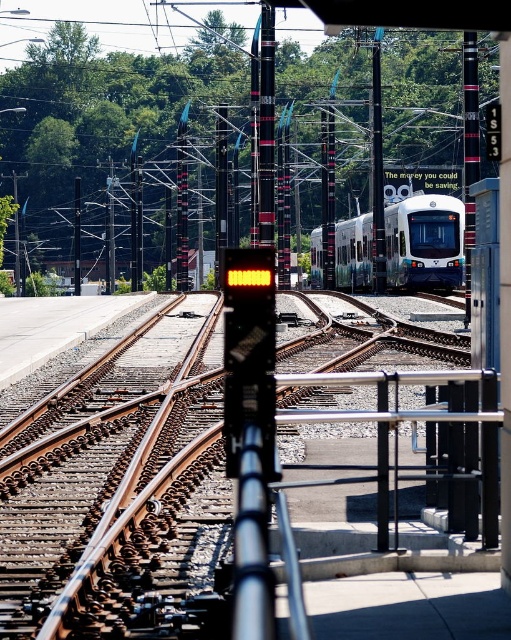
Consider the image. You are standing at the railway junction looking at the tracks. There are two points marked on the tracks. The first point is at coordinates point (311, 257) and the second point is at point (477, 84). Which point is closer to you?

Point (477, 84) is closer to you because it is less further to the camera than point (311, 257).

You are a maintenance worker checking the railway poles. You notice two poles, the black textured pole at center and the black metal pole at left. Which pole do you need to climb if you need to reach a higher point for maintenance?

The black textured pole at center has a larger size compared to the black metal pole at left, so you should climb the black textured pole at center to reach a higher point for maintenance.